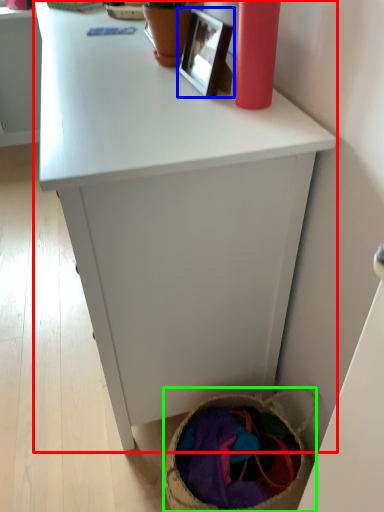
Question: Which object is the farthest from desk (highlighted by a red box)? Choose among these: picture frame (highlighted by a blue box) or basket (highlighted by a green box).

Choices:
 (A) picture frame
 (B) basket

Answer: (B)